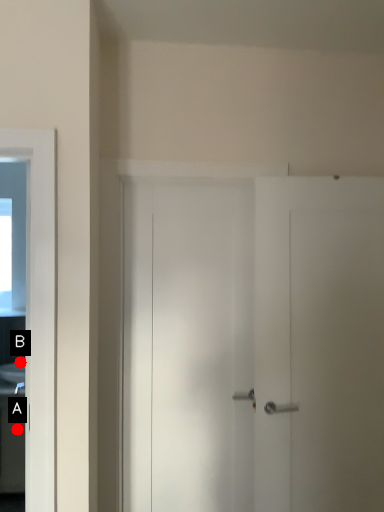
Question: Two points are circled on the image, labeled by A and B beside each circle. Which of the following is the closest to the observer?

Choices:
 (A) A is closer
 (B) B is closer

Answer: (A)